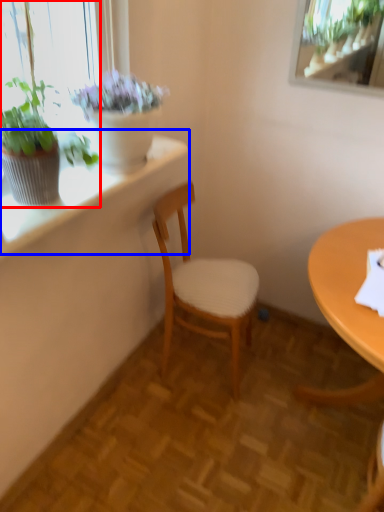
Question: Which point is further to the camera, houseplant (highlighted by a red box) or window sill (highlighted by a blue box)?

Choices:
 (A) houseplant
 (B) window sill

Answer: (B)